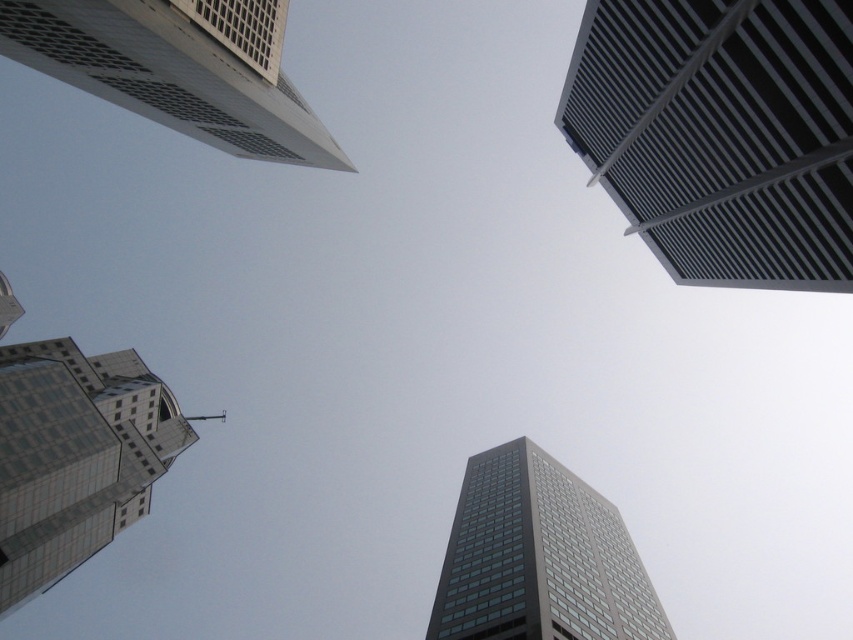
Question: Can you confirm if white textured building at upper left is positioned above matte glass tower at lower left?

Choices:
 (A) yes
 (B) no

Answer: (A)

Question: Considering the real-world distances, which object is closest to the metallic gray building at upper right?

Choices:
 (A) dark gray glass skyscraper at center
 (B) white textured building at upper left
 (C) matte glass tower at lower left

Answer: (A)

Question: Among these points, which one is nearest to the camera?

Choices:
 (A) (473, 529)
 (B) (767, 160)

Answer: (B)

Question: Is metallic gray building at upper right positioned at the back of white textured building at upper left?

Choices:
 (A) yes
 (B) no

Answer: (B)

Question: Can you confirm if white textured building at upper left is positioned below matte glass tower at lower left?

Choices:
 (A) yes
 (B) no

Answer: (B)

Question: Among these points, which one is farthest from the camera?

Choices:
 (A) (734, 49)
 (B) (103, 376)
 (C) (90, 76)
 (D) (558, 522)

Answer: (B)